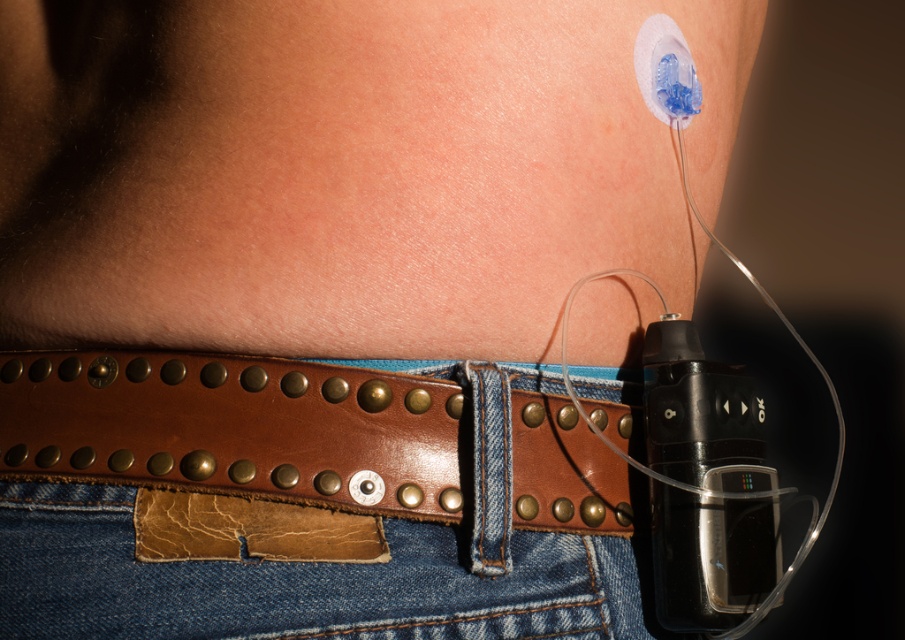
Question: Is brown leather belt at lower center to the right of leather/cracked at center from the viewer's perspective?

Choices:
 (A) no
 (B) yes

Answer: (B)

Question: Which point is closer to the camera?

Choices:
 (A) brown leather belt at lower center
 (B) leather/cracked at center

Answer: (B)

Question: Among these points, which one is farthest from the camera?

Choices:
 (A) (569, 528)
 (B) (252, 513)

Answer: (A)

Question: In this image, where is brown leather belt at lower center located relative to leather/cracked at center?

Choices:
 (A) right
 (B) left

Answer: (A)

Question: Is brown leather belt at lower center to the left of leather/cracked at center from the viewer's perspective?

Choices:
 (A) no
 (B) yes

Answer: (A)